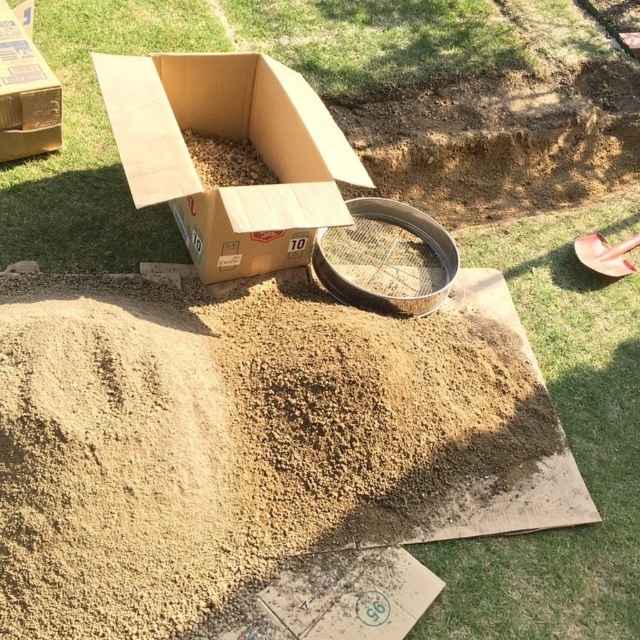
Does brown granular dirt at center appear on the right side of cardboard box at center?

Correct, you'll find brown granular dirt at center to the right of cardboard box at center.

Does brown granular dirt at center have a smaller size compared to cardboard box at center?

Actually, brown granular dirt at center might be larger than cardboard box at center.

Between point (442, 474) and point (301, 163), which one is positioned in front?

Point (442, 474)

This screenshot has height=640, width=640. I want to click on brown granular dirt at center, so click(221, 442).

Is silver metallic sieve at center thinner than brown cardboard box at upper left?

Incorrect, silver metallic sieve at center's width is not less than brown cardboard box at upper left's.

Is silver metallic sieve at center to the left of brown cardboard box at upper left from the viewer's perspective?

Incorrect, silver metallic sieve at center is not on the left side of brown cardboard box at upper left.

Is point (355, 211) positioned in front of point (16, 84)?

No, it is not.

Where is `silver metallic sieve at center`? silver metallic sieve at center is located at coordinates (387, 259).

Which is behind, point (333, 188) or point (58, 90)?

The point (58, 90) is behind.

Is cardboard box at center taller than brown cardboard box at upper left?

Indeed, cardboard box at center has a greater height compared to brown cardboard box at upper left.

This screenshot has width=640, height=640. Identify the location of cardboard box at center. (230, 138).